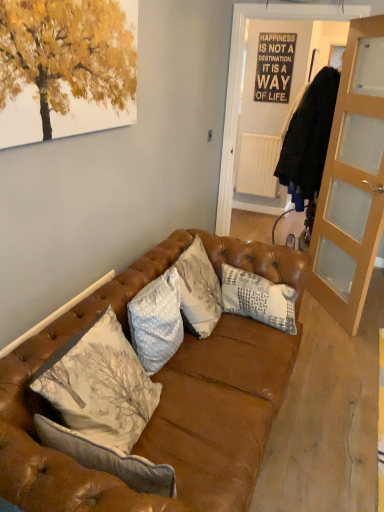
Question: Is light brown glass cabinet at right positioned far away from gray textured pillow at center, which is the first pillow in back-to-front order?

Choices:
 (A) yes
 (B) no

Answer: (A)

Question: From the image's perspective, does light brown glass cabinet at right appear lower than gray textured pillow at center, acting as the 2th pillow starting from the front?

Choices:
 (A) yes
 (B) no

Answer: (B)

Question: Considering the relative positions of light brown glass cabinet at right and gray textured pillow at center, acting as the 2th pillow starting from the front, in the image provided, is light brown glass cabinet at right in front of gray textured pillow at center, acting as the 2th pillow starting from the front,?

Choices:
 (A) yes
 (B) no

Answer: (B)

Question: Can you confirm if light brown glass cabinet at right is shorter than gray textured pillow at center, which is the 2th pillow in left-to-right order?

Choices:
 (A) no
 (B) yes

Answer: (A)

Question: Can you confirm if light brown glass cabinet at right is smaller than gray textured pillow at center, acting as the 2th pillow starting from the front?

Choices:
 (A) yes
 (B) no

Answer: (B)

Question: Considering the relative positions of light brown glass cabinet at right and gray textured pillow at center, the first pillow positioned from the right, in the image provided, is light brown glass cabinet at right behind gray textured pillow at center, the first pillow positioned from the right,?

Choices:
 (A) yes
 (B) no

Answer: (A)

Question: Does white matte radiator at center have a greater width compared to black paper poster at upper center?

Choices:
 (A) no
 (B) yes

Answer: (B)

Question: From a real-world perspective, is white matte radiator at center over black paper poster at upper center?

Choices:
 (A) yes
 (B) no

Answer: (B)

Question: Would you say white matte radiator at center contains black paper poster at upper center?

Choices:
 (A) yes
 (B) no

Answer: (B)

Question: Is white matte radiator at center with black paper poster at upper center?

Choices:
 (A) yes
 (B) no

Answer: (B)

Question: Would you consider white matte radiator at center to be distant from black paper poster at upper center?

Choices:
 (A) yes
 (B) no

Answer: (B)

Question: Is white matte radiator at center bigger than black paper poster at upper center?

Choices:
 (A) no
 (B) yes

Answer: (B)

Question: Is light brown glass cabinet at right a part of gray textured pillow at center, acting as the 2th pillow starting from the front?

Choices:
 (A) yes
 (B) no

Answer: (B)